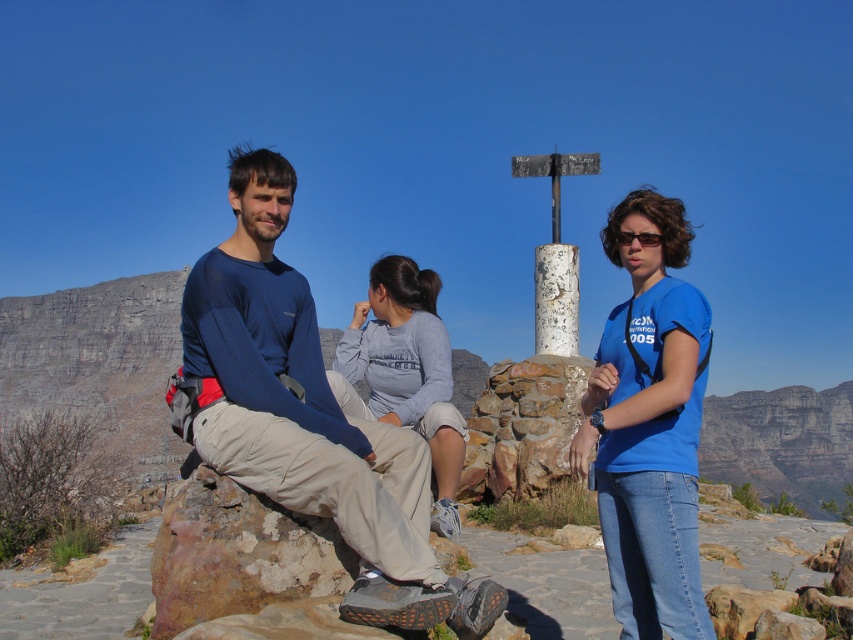
You are standing at the scenic overlook and want to place a small flag at the point that is closer to the camera. Which point should you choose between point (287,380) and point (628,339)?

Point (287,380) is in front of point (628,339), so you should place the flag at point (287,380) to be closer to the camera.